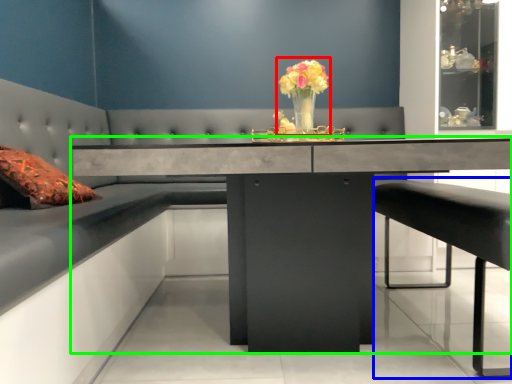
Question: Which is nearer to the floral arrangement (highlighted by a red box)? bar stool (highlighted by a blue box) or table (highlighted by a green box).

Choices:
 (A) bar stool
 (B) table

Answer: (B)